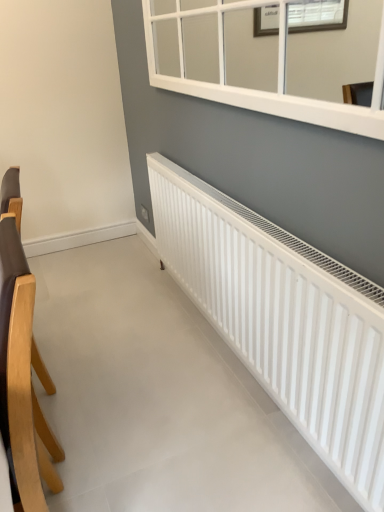
Question: Considering the relative positions of brown leather chair at left and white matte radiator at lower right in the image provided, is brown leather chair at left to the right of white matte radiator at lower right from the viewer's perspective?

Choices:
 (A) yes
 (B) no

Answer: (B)

Question: Is brown leather chair at left facing away from white matte radiator at lower right?

Choices:
 (A) no
 (B) yes

Answer: (A)

Question: Can you confirm if brown leather chair at left is wider than white matte radiator at lower right?

Choices:
 (A) no
 (B) yes

Answer: (A)

Question: Can white matte radiator at lower right be found inside brown leather chair at left?

Choices:
 (A) no
 (B) yes

Answer: (A)

Question: From the image's perspective, is brown leather chair at left above white matte radiator at lower right?

Choices:
 (A) yes
 (B) no

Answer: (B)

Question: Is brown leather chair at left behind white matte radiator at lower right?

Choices:
 (A) yes
 (B) no

Answer: (B)

Question: From the image's perspective, is white matte radiator at lower right on brown leather chair at left?

Choices:
 (A) no
 (B) yes

Answer: (B)

Question: From the image's perspective, would you say white matte radiator at lower right is shown under brown leather chair at left?

Choices:
 (A) yes
 (B) no

Answer: (B)

Question: Is white matte radiator at lower right positioned behind brown leather chair at left?

Choices:
 (A) yes
 (B) no

Answer: (A)

Question: Does white matte radiator at lower right have a greater width compared to brown leather chair at left?

Choices:
 (A) yes
 (B) no

Answer: (A)

Question: Can you confirm if white matte radiator at lower right is positioned to the left of brown leather chair at left?

Choices:
 (A) yes
 (B) no

Answer: (B)

Question: Is brown leather chair at left located within white matte radiator at lower right?

Choices:
 (A) no
 (B) yes

Answer: (A)

Question: Considering the positions of white matte radiator at lower right and brown leather chair at left in the image, is white matte radiator at lower right taller or shorter than brown leather chair at left?

Choices:
 (A) tall
 (B) short

Answer: (B)